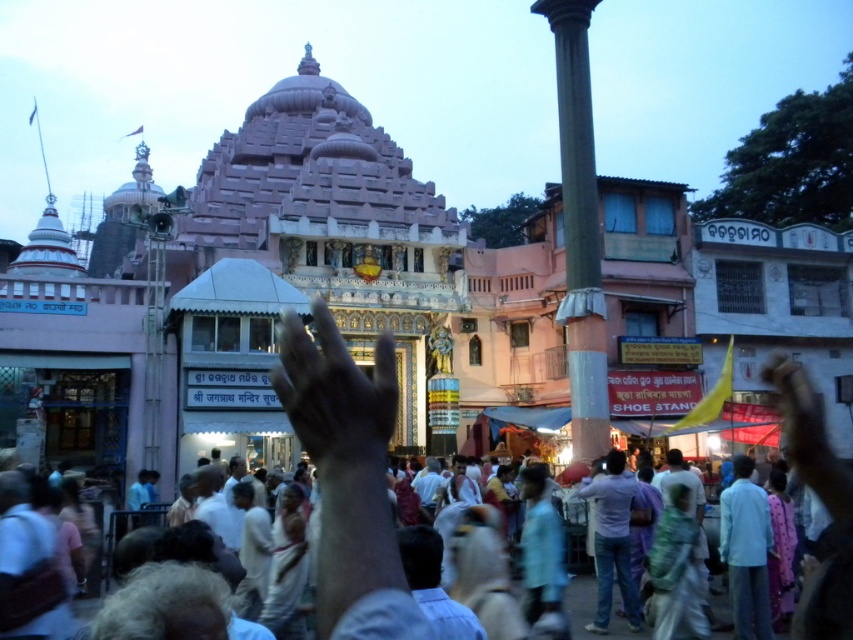
You are standing in the temple courtyard and want to touch both the smooth gray column at center and the white cotton clothing at center. Which object will you reach first?

You will reach the smooth gray column at center first because it is closer to you than the white cotton clothing at center.